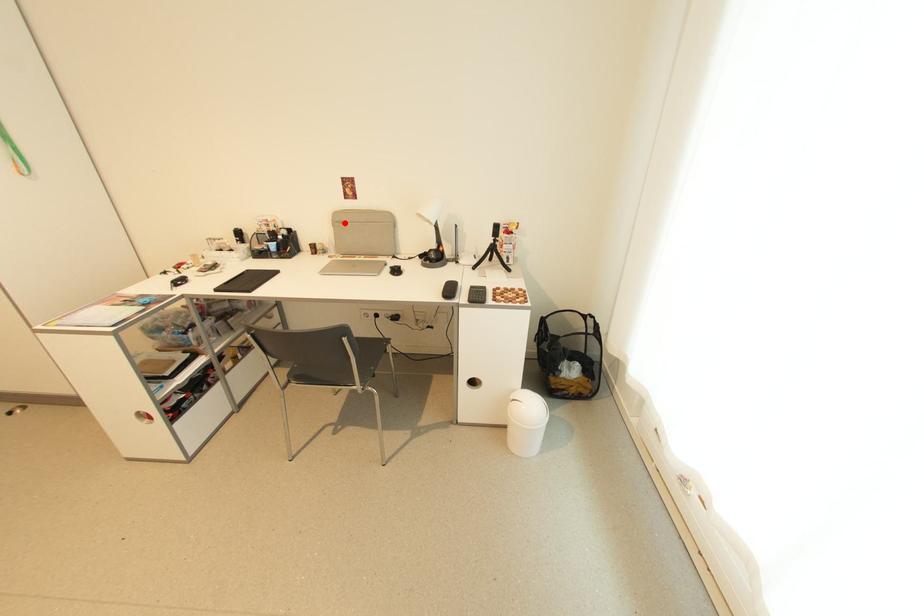
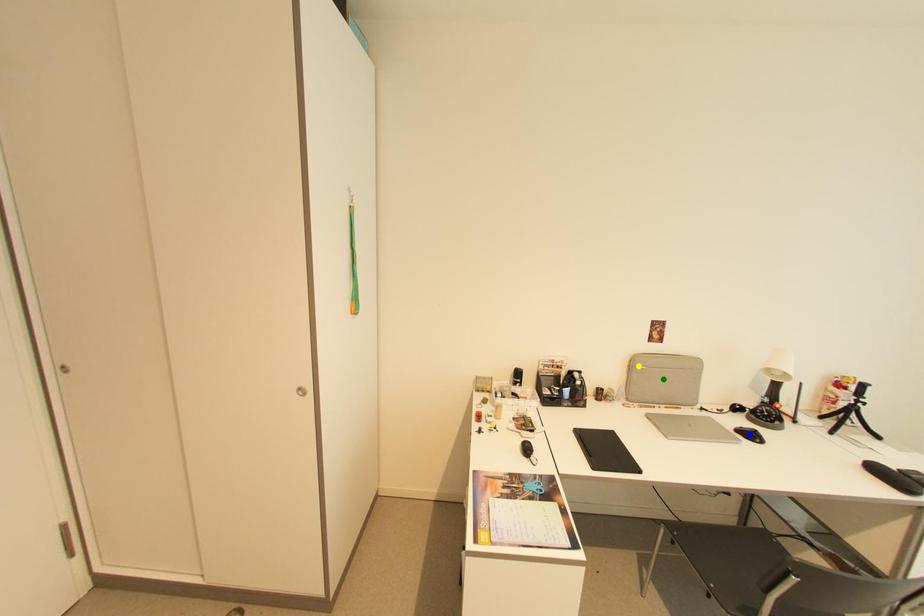
Question: I am providing you with two images of the same scene from different viewpoints. A red point is marked on the first image. You are given multiple points on the second image. Which spot in image 2 lines up with the point in image 1?

Choices:
 (A) blue point
 (B) green point
 (C) yellow point

Answer: (C)